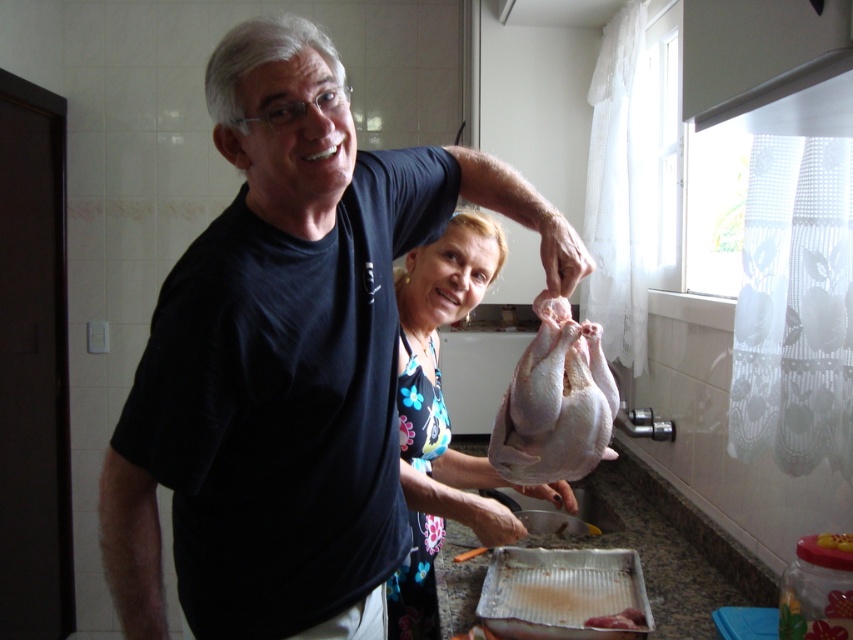
You are a chef observing the kitchen scene. You need to locate the white floral dress at center and the pinkish raw meat at lower center. Which object is positioned to the right side of the other?

The white floral dress at center is to the left of pinkish raw meat at lower center, so the pinkish raw meat at lower center is positioned to the right of the white floral dress at center.

You are standing in the kitchen and want to reach the pinkish raw meat at lower center without moving the white floral dress at center. Is this possible?

The white floral dress at center is further to the viewer than the pinkish raw meat at lower center, so you can reach the pinkish raw meat at lower center without moving the white floral dress at center because it is closer to you.